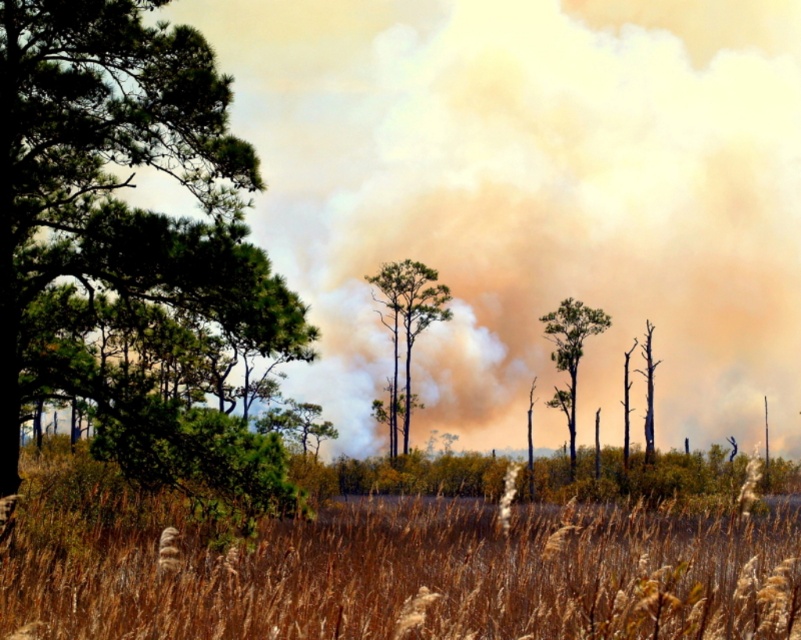
Question: Which point is farther from the camera taking this photo?

Choices:
 (A) (325, 624)
 (B) (647, 388)
 (C) (10, 268)
 (D) (405, 310)

Answer: (D)

Question: Can you confirm if green leafy tree at center is positioned to the right of charred wood tree at center?

Choices:
 (A) yes
 (B) no

Answer: (B)

Question: Can you confirm if green leafy tree at center is bigger than charred wood tree at center?

Choices:
 (A) no
 (B) yes

Answer: (B)

Question: Which point is closer to the camera?

Choices:
 (A) green matte tree at center
 (B) brown dry grass at center
 (C) green leafy tree at center
 (D) green matte tree at left

Answer: (B)

Question: Considering the relative positions of green matte tree at left and green matte tree at center in the image provided, where is green matte tree at left located with respect to green matte tree at center?

Choices:
 (A) below
 (B) above

Answer: (A)

Question: Which point appears farthest from the camera in this image?

Choices:
 (A) (562, 397)
 (B) (141, 458)
 (C) (683, 628)
 (D) (413, 333)

Answer: (D)